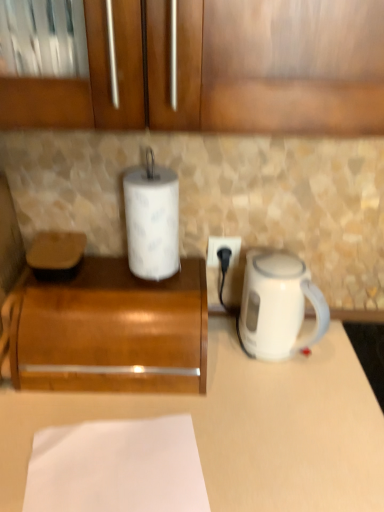
Identify the location of vacant space that is in between wooden at left and white paper at lower center. The image size is (384, 512). (101, 419).